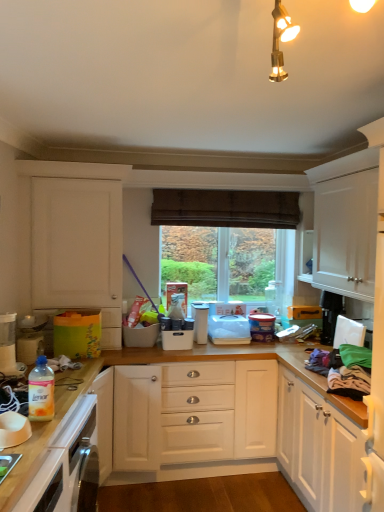
This screenshot has width=384, height=512. I want to click on white matte cabinet at left, so click(76, 243).

Locate an element on the screen. This screenshot has width=384, height=512. purple matte canister at center, acting as the third appliance starting from the left is located at coordinates (262, 326).

Describe the element at coordinates (9, 347) in the screenshot. I see `translucent plastic bottle at lower left` at that location.

Describe the element at coordinates (177, 333) in the screenshot. I see `white plastic container at center, placed as the fourth appliance when sorted from right to left` at that location.

The image size is (384, 512). Identify the location of translucent plastic bottle at lower left, acting as the 1th bottle starting from the front. (41, 391).

Considering the sizes of objects translucent plastic bottle at lower left and white plastic bowl at lower left in the image provided, who is shorter, translucent plastic bottle at lower left or white plastic bowl at lower left?

With less height is white plastic bowl at lower left.

Is translucent plastic bottle at lower left thinner than white plastic bowl at lower left?

No.

How much distance is there between translucent plastic bottle at lower left and white plastic bowl at lower left?

The distance of translucent plastic bottle at lower left from white plastic bowl at lower left is 26.07 inches.

Is brown textured curtain at center aimed at purple matte canister at center, acting as the third appliance starting from the left?

No, brown textured curtain at center does not turn towards purple matte canister at center, acting as the third appliance starting from the left.

There is a brown textured curtain at center. In order to click on the 3rd appliance below it (from a real-world perspective) in this screenshot , I will do `click(262, 326)`.

In the scene shown: Considering the relative positions of brown textured curtain at center and purple matte canister at center, acting as the third appliance starting from the left, in the image provided, is brown textured curtain at center to the right of purple matte canister at center, acting as the third appliance starting from the left, from the viewer's perspective?

Incorrect, brown textured curtain at center is not on the right side of purple matte canister at center, acting as the third appliance starting from the left.

From the image's perspective, which is above, purple matte canister at center, acting as the third appliance starting from the left, or clear glass window at center?

From the image's view, clear glass window at center is above.

At what (x,y) coordinates should I click in order to perform the action: click on appliance that is the 1st one when counting forward from the clear glass window at center. Please return your answer as a coordinate pair (x, y). Image resolution: width=384 pixels, height=512 pixels. Looking at the image, I should click on (262, 326).

In the scene shown: Which object is thinner, purple matte canister at center, acting as the third appliance starting from the left, or clear glass window at center?

clear glass window at center.

Who is shorter, purple matte canister at center, acting as the third appliance starting from the left, or white plastic bowl at lower left?

white plastic bowl at lower left is shorter.

From a real-world perspective, which object rests below the other?

white plastic bowl at lower left, from a real-world perspective.

Is purple matte canister at center, arranged as the 2th appliance when viewed from the right, touching white plastic bowl at lower left?

purple matte canister at center, arranged as the 2th appliance when viewed from the right, is not next to white plastic bowl at lower left, and they're not touching.

Looking at this image, from the image's perspective, is clear glass window at center located beneath wooden at left?

Actually, clear glass window at center appears above wooden at left in the image.

Is clear glass window at center surrounding wooden at left?

No, wooden at left is not surrounded by clear glass window at center.

How far apart are clear glass window at center and wooden at left?

A distance of 4.98 feet exists between clear glass window at center and wooden at left.

I want to click on countertop directly beneath the clear glass window at center (from a real-world perspective), so click(49, 422).

There is a wooden at left. Where is `the 1st appliance above it (from the image's perspective)`? This screenshot has height=512, width=384. the 1st appliance above it (from the image's perspective) is located at coordinates (177, 333).

From the picture: In the image, is white plastic container at center, placed as the fourth appliance when sorted from right to left, positioned in front of or behind wooden at left?

Clearly, white plastic container at center, placed as the fourth appliance when sorted from right to left, is behind wooden at left.

From the image's perspective, would you say white plastic container at center, placed as the fourth appliance when sorted from right to left, is shown under wooden at left?

No.

Is brown textured curtain at center aimed at wooden at left?

No, brown textured curtain at center is not aimed at wooden at left.

Considering the sizes of objects brown textured curtain at center and wooden at left in the image provided, who is wider, brown textured curtain at center or wooden at left?

wooden at left.

From a real-world perspective, does brown textured curtain at center sit lower than wooden at left?

No, from a real-world perspective, brown textured curtain at center is not under wooden at left.

You are a GUI agent. You are given a task and a screenshot of the screen. Output one action in this format:
    pyautogui.click(x=<x>, y=<y>)
    Task: Click on the bowl in front of the translucent plastic bottle at lower left
    The width and height of the screenshot is (384, 512).
    Given the screenshot: What is the action you would take?
    pyautogui.click(x=13, y=429)

Identify the location of curtain located on the left of purple matte canister at center, arranged as the 2th appliance when viewed from the right. This screenshot has width=384, height=512. (225, 208).

Based on their spatial positions, is clear glass bottle at upper center, the 1th bottle from the top, or white plastic container at center, placed as the fourth appliance when sorted from right to left, closer to clear glass window at center?

clear glass bottle at upper center, the 1th bottle from the top, is positioned closer to the anchor clear glass window at center.

Estimate the real-world distances between objects in this image. Which object is closer to white plastic container at center, the first appliance positioned from the left, white plastic bowl at lower left or black plastic toaster at upper right, which appears as the first appliance when viewed from the right?

black plastic toaster at upper right, which appears as the first appliance when viewed from the right.

When comparing their distances from white matte cabinet at left, does wooden at left or translucent plastic bottle at lower left, acting as the 1th bottle starting from the front, seem further?

→ Based on the image, translucent plastic bottle at lower left, acting as the 1th bottle starting from the front, appears to be further to white matte cabinet at left.

From the image, which object appears to be farther from white plastic bowl at lower left, white plastic container at center, the first appliance positioned from the left, or purple matte canister at center, arranged as the 2th appliance when viewed from the right?

The object further to white plastic bowl at lower left is purple matte canister at center, arranged as the 2th appliance when viewed from the right.

Which object lies nearer to the anchor point white plastic container at center, acting as the 2th appliance starting from the left, translucent plastic bottle at lower left or brown textured curtain at center?

Among the two, brown textured curtain at center is located nearer to white plastic container at center, acting as the 2th appliance starting from the left.

Which object lies further to the anchor point white plastic container at center, placed as the fourth appliance when sorted from right to left, translucent plastic bottle at lower left or clear glass bottle at upper center, the 2th bottle viewed from the left?

Among the two, clear glass bottle at upper center, the 2th bottle viewed from the left, is located further to white plastic container at center, placed as the fourth appliance when sorted from right to left.

Looking at the image, which one is located closer to white plastic container at center, the first appliance positioned from the left, black plastic toaster at upper right, marked as the fourth appliance in a left-to-right arrangement, or white plastic container at center, acting as the 2th appliance starting from the left?

white plastic container at center, acting as the 2th appliance starting from the left.

Based on their spatial positions, is white plastic container at center, placed as the fourth appliance when sorted from right to left, or black plastic toaster at upper right, marked as the fourth appliance in a left-to-right arrangement, further from wooden at left?

black plastic toaster at upper right, marked as the fourth appliance in a left-to-right arrangement, is further to wooden at left.

Identify the location of bowl between wooden at left and black plastic toaster at upper right, which appears as the first appliance when viewed from the right. Image resolution: width=384 pixels, height=512 pixels. pyautogui.click(x=13, y=429).

Image resolution: width=384 pixels, height=512 pixels. I want to click on countertop positioned between white plastic bowl at lower left and clear glass bottle at upper center, the 1th bottle in the back-to-front sequence, from near to far, so click(49, 422).

Locate an element on the screen. This screenshot has height=512, width=384. window screen that lies between brown textured curtain at center and purple matte canister at center, arranged as the 2th appliance when viewed from the right, from top to bottom is located at coordinates (218, 261).

This screenshot has height=512, width=384. What are the coordinates of `countertop located between white plastic bowl at lower left and white plastic container at center, acting as the 2th appliance starting from the left, in the depth direction` in the screenshot? It's located at (49, 422).